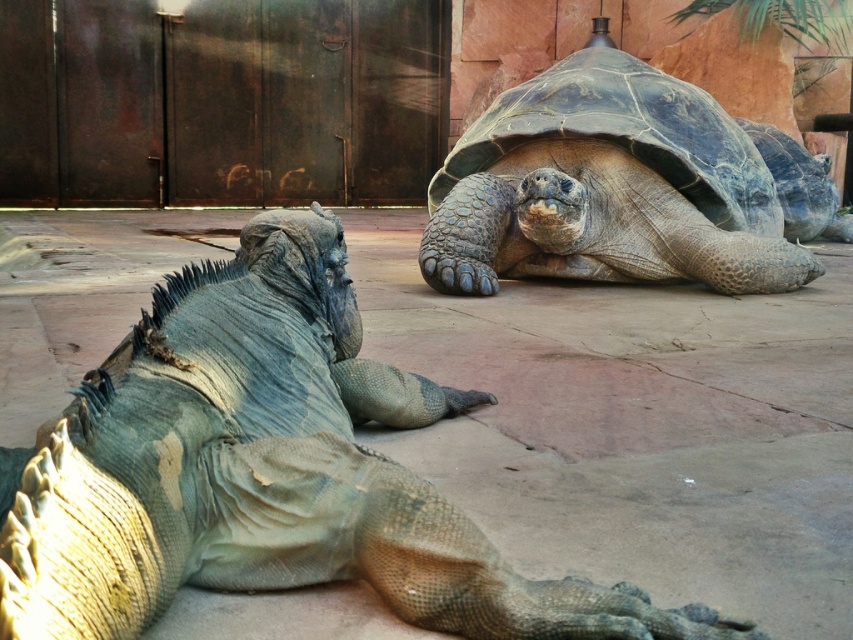
Between scaly gray iguana at center and shiny dark green tortoise at upper right, which one appears on the right side from the viewer's perspective?

Positioned to the right is shiny dark green tortoise at upper right.

Which of these two, scaly gray iguana at center or shiny dark green tortoise at upper right, stands taller?

shiny dark green tortoise at upper right

Between point (735, 627) and point (828, 196), which one is positioned behind?

The point (828, 196) is more distant.

The height and width of the screenshot is (640, 853). I want to click on scaly gray iguana at center, so click(x=267, y=472).

Who is more forward, (666, 157) or (810, 228)?

Point (666, 157) is in front.

Is point (659, 109) behind point (786, 148)?

No, it is in front of (786, 148).

You are a GUI agent. You are given a task and a screenshot of the screen. Output one action in this format:
    pyautogui.click(x=<x>, y=<y>)
    Task: Click on the dark gray textured tortoise at center
    The width and height of the screenshot is (853, 640).
    Given the screenshot: What is the action you would take?
    pyautogui.click(x=607, y=188)

Where is `scaly gray iguana at center`? Image resolution: width=853 pixels, height=640 pixels. scaly gray iguana at center is located at coordinates (267, 472).

Which is in front, point (318, 252) or point (807, 257)?

Point (318, 252) is more forward.

At what (x,y) coordinates should I click in order to perform the action: click on scaly gray iguana at center. Please return your answer as a coordinate pair (x, y). The height and width of the screenshot is (640, 853). Looking at the image, I should click on (267, 472).